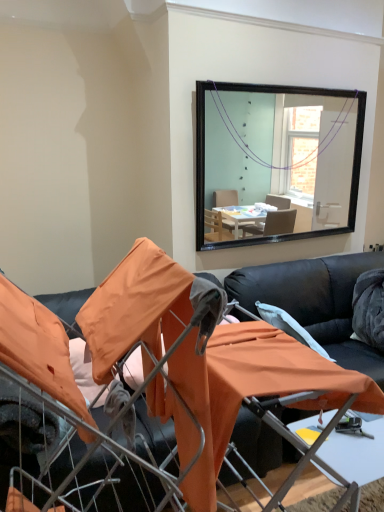
Question: Can you confirm if black leather couch at center is taller than white plastic table at lower center?

Choices:
 (A) no
 (B) yes

Answer: (B)

Question: Is black leather couch at center not inside white plastic table at lower center?

Choices:
 (A) no
 (B) yes

Answer: (B)

Question: Considering the relative sizes of black leather couch at center and white plastic table at lower center in the image provided, is black leather couch at center smaller than white plastic table at lower center?

Choices:
 (A) yes
 (B) no

Answer: (B)

Question: Can you confirm if black leather couch at center is thinner than white plastic table at lower center?

Choices:
 (A) yes
 (B) no

Answer: (B)

Question: Can you see black leather couch at center touching white plastic table at lower center?

Choices:
 (A) no
 (B) yes

Answer: (A)

Question: From a real-world perspective, is black leather couch at center physically located above or below black leather couch at center?

Choices:
 (A) below
 (B) above

Answer: (A)

Question: Choose the correct answer: Is black leather couch at center inside black leather couch at center or outside it?

Choices:
 (A) inside
 (B) outside

Answer: (B)

Question: From the image's perspective, relative to black leather couch at center, is black leather couch at center above or below?

Choices:
 (A) below
 (B) above

Answer: (B)

Question: Is point (311, 331) closer or farther from the camera than point (54, 377)?

Choices:
 (A) farther
 (B) closer

Answer: (A)

Question: From a real-world perspective, relative to black leather couch at center, is white plastic table at lower center vertically above or below?

Choices:
 (A) above
 (B) below

Answer: (B)

Question: Considering their positions, is white plastic table at lower center located in front of or behind black leather couch at center?

Choices:
 (A) behind
 (B) front

Answer: (A)

Question: From the image's perspective, relative to black leather couch at center, is white plastic table at lower center above or below?

Choices:
 (A) above
 (B) below

Answer: (B)

Question: In terms of width, does white plastic table at lower center look wider or thinner when compared to black leather couch at center?

Choices:
 (A) thin
 (B) wide

Answer: (A)

Question: In terms of width, does black leather couch at center look wider or thinner when compared to white plastic table at lower center?

Choices:
 (A) wide
 (B) thin

Answer: (A)

Question: From a real-world perspective, is black leather couch at center positioned above or below white plastic table at lower center?

Choices:
 (A) below
 (B) above

Answer: (B)